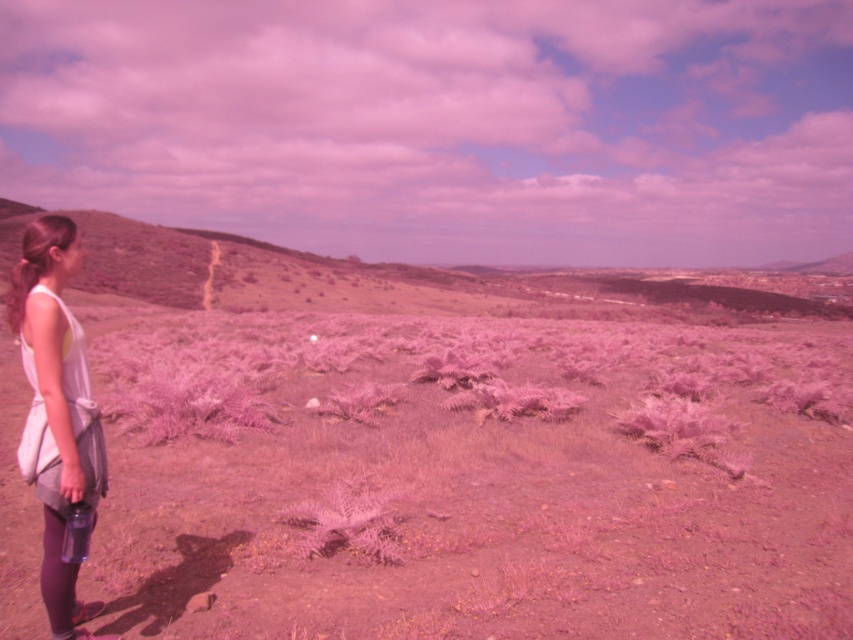
Question: Can you confirm if dried grass at upper left is positioned to the right of blonde hair at left?

Choices:
 (A) no
 (B) yes

Answer: (B)

Question: Estimate the real-world distances between objects in this image. Which object is farther from the white fabric dress at left?

Choices:
 (A) blonde hair at left
 (B) dusty pink dirt field at center

Answer: (B)

Question: Which object appears closest to the camera in this image?

Choices:
 (A) blonde hair at left
 (B) dusty pink dirt field at center
 (C) white fabric dress at left

Answer: (C)

Question: Which is nearer to the dusty pink dirt field at center?

Choices:
 (A) blonde hair at left
 (B) dried grass at upper left
 (C) white fabric dress at left

Answer: (C)

Question: From the image, what is the correct spatial relationship of dusty pink dirt field at center in relation to blonde hair at left?

Choices:
 (A) above
 (B) below

Answer: (B)

Question: Can you confirm if dusty pink dirt field at center is positioned below dried grass at upper left?

Choices:
 (A) no
 (B) yes

Answer: (B)